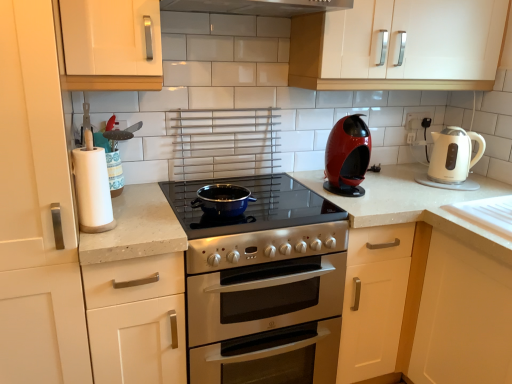
Where is `empty space that is to the right of white matte paper towel at left`? This screenshot has width=512, height=384. empty space that is to the right of white matte paper towel at left is located at coordinates point(143,222).